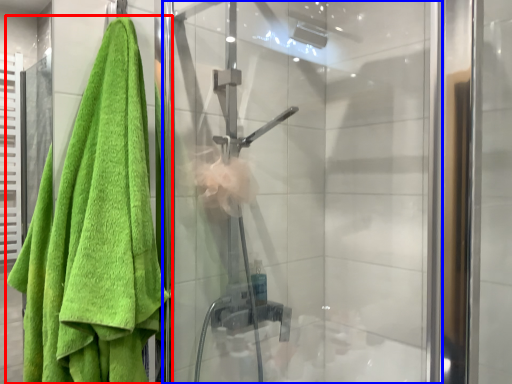
Question: Which of the following is the farthest to the observer, towel (highlighted by a red box) or screen door (highlighted by a blue box)?

Choices:
 (A) towel
 (B) screen door

Answer: (B)